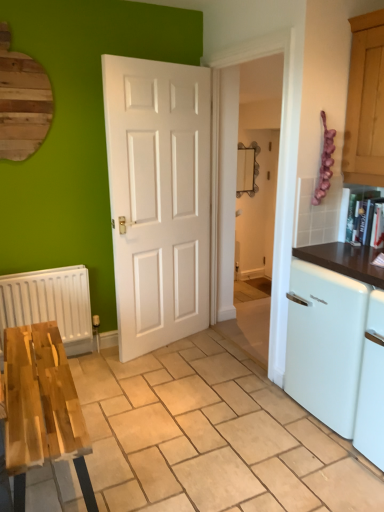
Question: Is white glossy dishwasher at right at the left side of white matte radiator at left?

Choices:
 (A) yes
 (B) no

Answer: (B)

Question: Can you confirm if white glossy dishwasher at right is smaller than white matte radiator at left?

Choices:
 (A) yes
 (B) no

Answer: (B)

Question: From a real-world perspective, does white glossy dishwasher at right sit lower than white matte radiator at left?

Choices:
 (A) no
 (B) yes

Answer: (A)

Question: Is white matte radiator at left completely or partially inside white glossy dishwasher at right?

Choices:
 (A) yes
 (B) no

Answer: (B)

Question: Could you tell me if white glossy dishwasher at right is turned towards white matte radiator at left?

Choices:
 (A) no
 (B) yes

Answer: (A)

Question: Does point (311, 330) appear closer or farther from the camera than point (96, 353)?

Choices:
 (A) farther
 (B) closer

Answer: (B)

Question: Is white glossy dishwasher at right in front of or behind wooden table at lower left in the image?

Choices:
 (A) front
 (B) behind

Answer: (B)

Question: From the image's perspective, relative to wooden table at lower left, is white glossy dishwasher at right above or below?

Choices:
 (A) above
 (B) below

Answer: (A)

Question: From a real-world perspective, is white glossy dishwasher at right above or below wooden table at lower left?

Choices:
 (A) below
 (B) above

Answer: (B)

Question: Considering the positions of white matte radiator at left and wooden table at lower left in the image, is white matte radiator at left wider or thinner than wooden table at lower left?

Choices:
 (A) wide
 (B) thin

Answer: (B)

Question: Is point (46, 282) positioned closer to the camera than point (145, 499)?

Choices:
 (A) closer
 (B) farther

Answer: (B)

Question: Considering their positions, is white matte radiator at left located in front of or behind wooden table at lower left?

Choices:
 (A) behind
 (B) front

Answer: (A)

Question: From a real-world perspective, is white matte radiator at left physically located above or below wooden table at lower left?

Choices:
 (A) above
 (B) below

Answer: (A)

Question: Considering the positions of point (360, 347) and point (72, 345), is point (360, 347) closer or farther from the camera than point (72, 345)?

Choices:
 (A) closer
 (B) farther

Answer: (A)

Question: From a real-world perspective, is white glossy dishwasher at right above or below white matte radiator at left?

Choices:
 (A) below
 (B) above

Answer: (B)